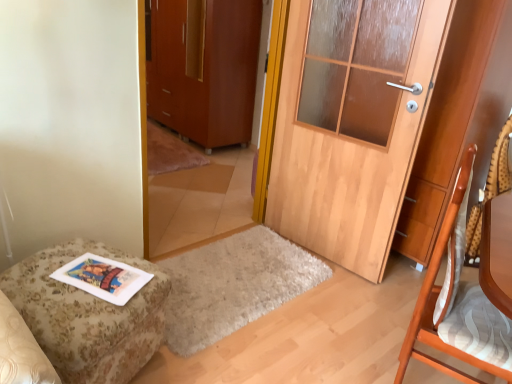
Find the location of a particular element. The width and height of the screenshot is (512, 384). free space above floral fabric ottoman at lower left (from a real-world perspective) is located at coordinates (74, 277).